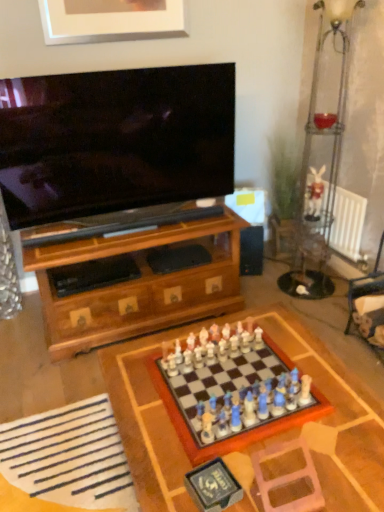
Where is `vacant area that lies to the right of wooden chess set at center`? The image size is (384, 512). vacant area that lies to the right of wooden chess set at center is located at coordinates (330, 391).